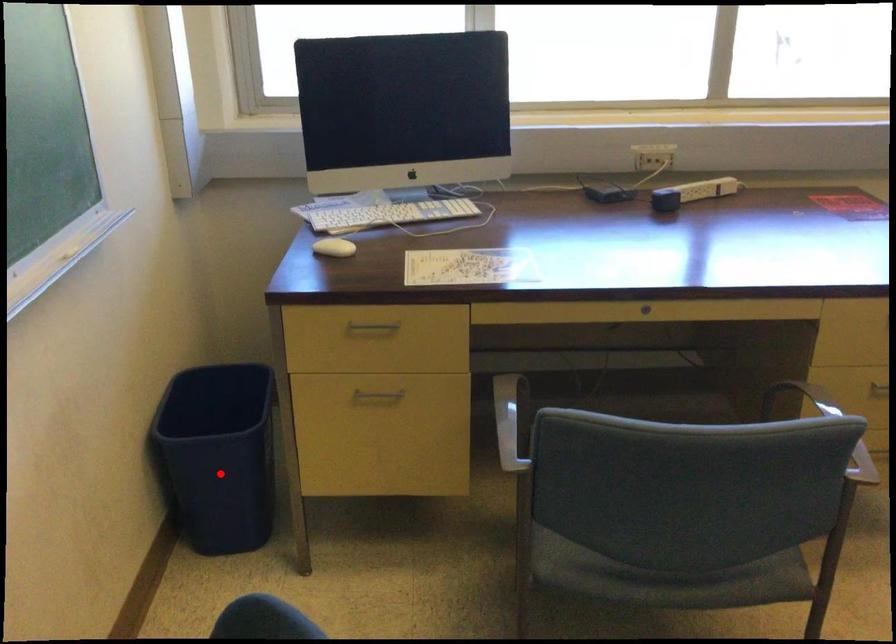
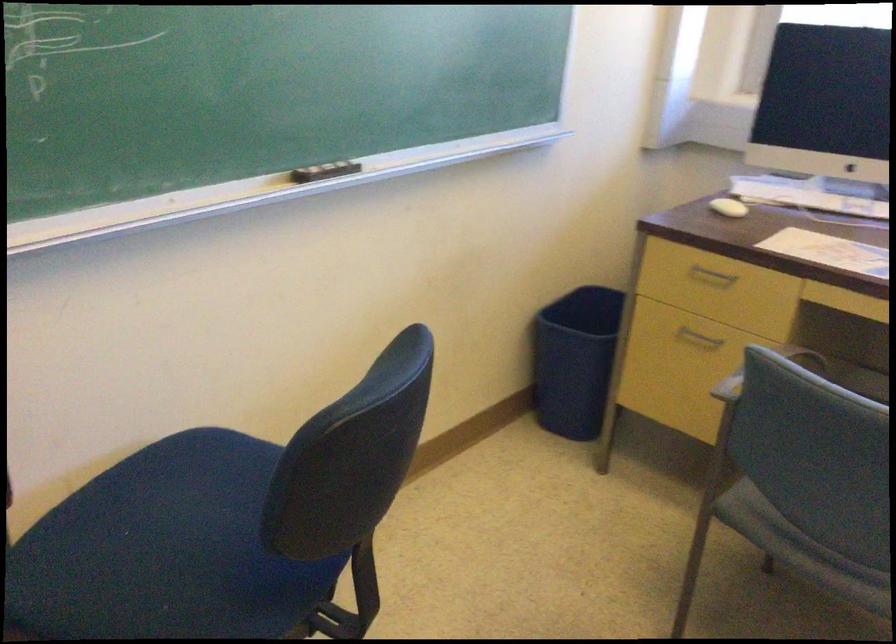
In the second image, find the point that corresponds to the highlighted location in the first image.

(574, 360)